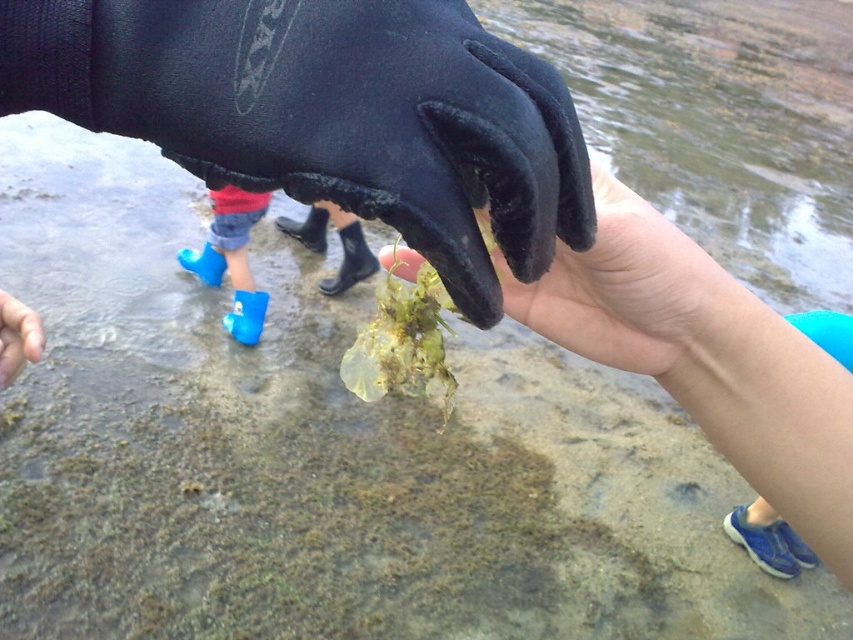
You are a marine biologist examining the image. You need to determine which object is smaller between the black neoprene glove at center and the blue rubber boot at lower left. Based on the scene, which one is smaller?

The black neoprene glove at center is smaller than the blue rubber boot at lower left according to the description.

You are a marine biologist examining the image. You notice the matte black glove at center and the smooth skin hand at lower left. Which object is positioned to the right side of the other?

The matte black glove at center is to the right of smooth skin hand at lower left.